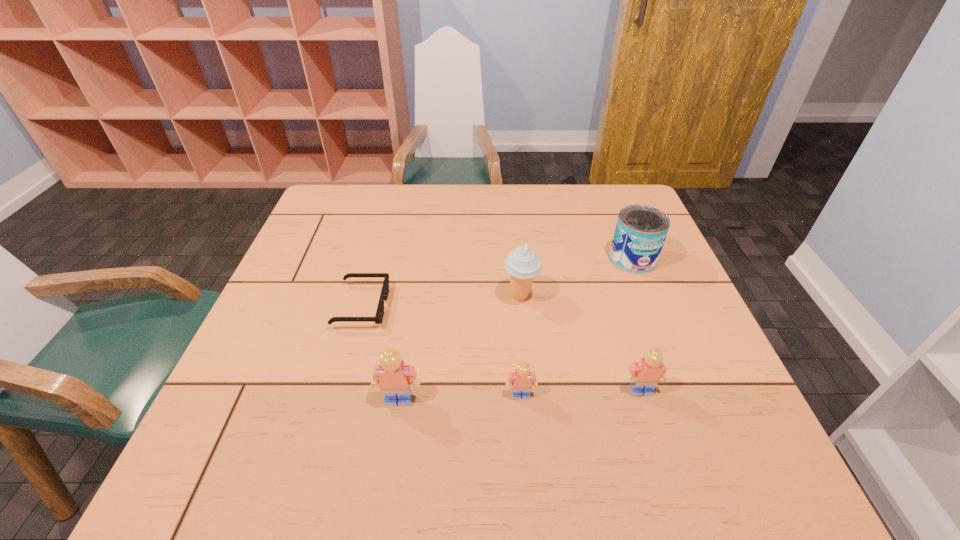
Considering the uniform spacing of Legos, where should an additional Lego be positioned on the left? Please locate a free spot. Please provide its 2D coordinates. Your answer should be formatted as a tuple, i.e. [(x, y)], where the tuple contains the x and y coordinates of a point satisfying the conditions above.

[(275, 404)]